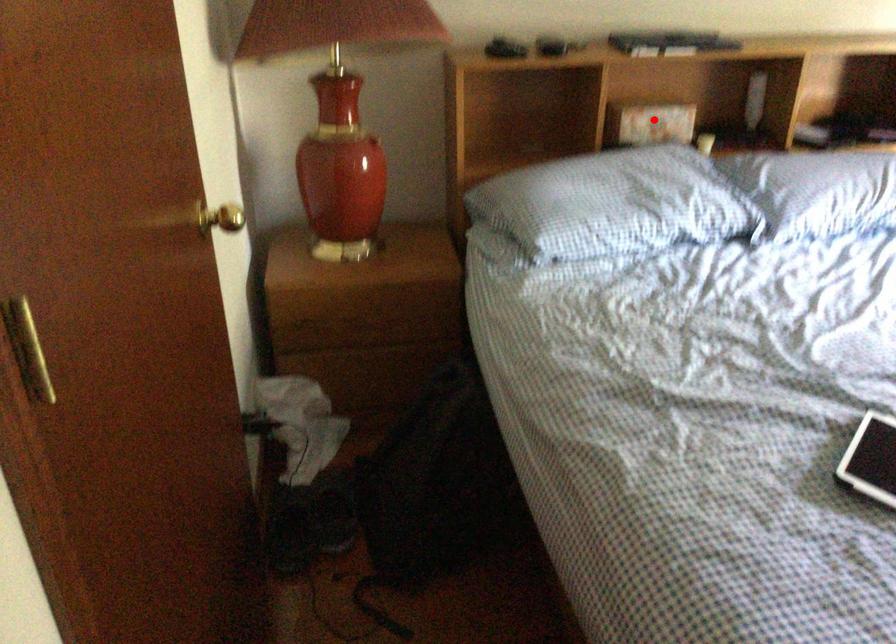
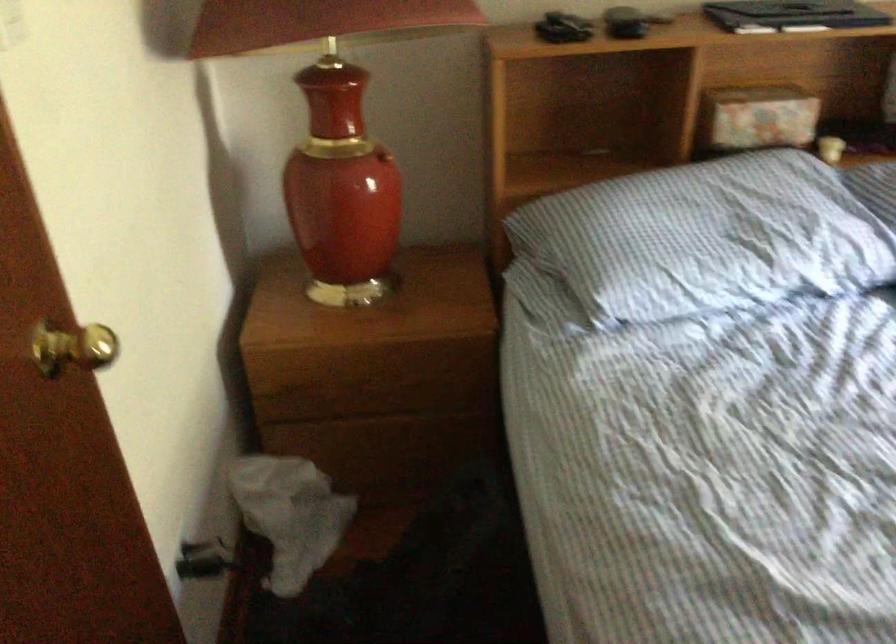
The point at the highlighted location is marked in the first image. Where is the corresponding point in the second image?

(757, 118)